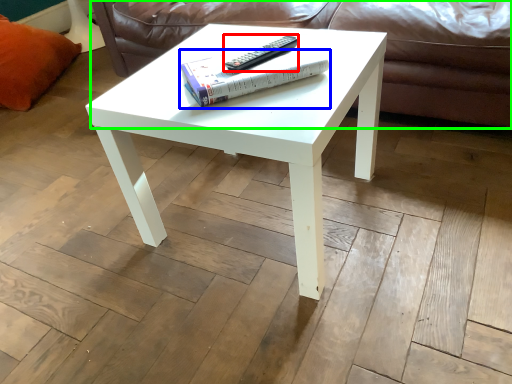
Question: Which object is the closest to the remote (highlighted by a red box)? Choose among these: paperback book (highlighted by a blue box) or couch (highlighted by a green box).

Choices:
 (A) paperback book
 (B) couch

Answer: (A)